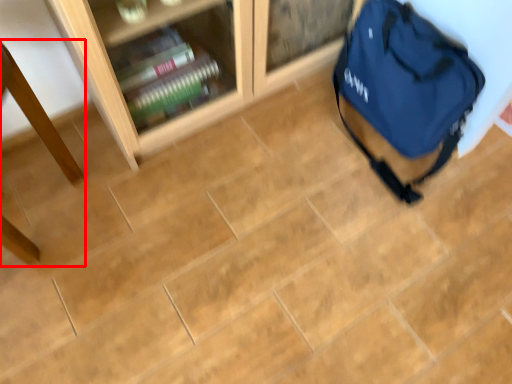
Question: From the image, what is the correct spatial relationship of table (annotated by the red box) in relation to backpack?

Choices:
 (A) left
 (B) right

Answer: (A)